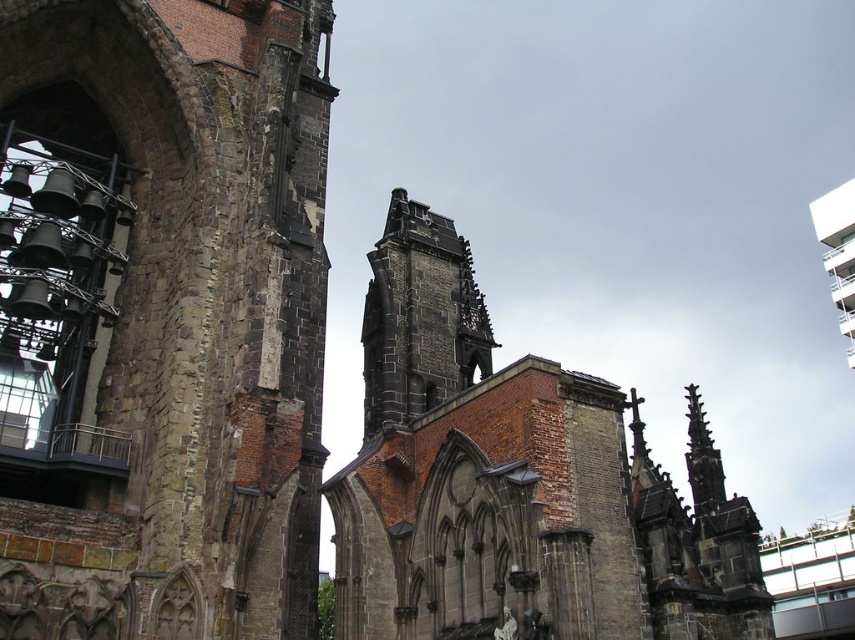
Does point (68, 10) come in front of point (417, 385)?

Yes.

Is rusty stone tower at left to the right of dark gray stone tower at center from the viewer's perspective?

Incorrect, rusty stone tower at left is not on the right side of dark gray stone tower at center.

Does point (251, 244) come closer to viewer compared to point (470, 291)?

Yes, it is in front of point (470, 291).

The height and width of the screenshot is (640, 855). I want to click on rusty stone tower at left, so click(x=161, y=316).